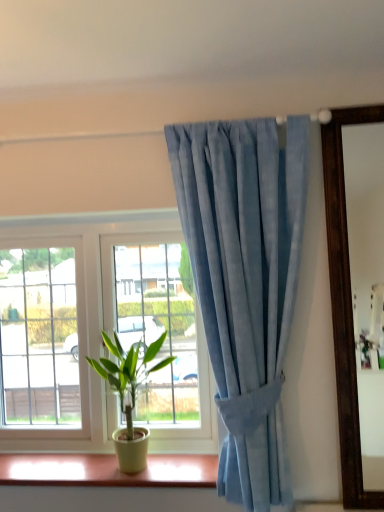
Image resolution: width=384 pixels, height=512 pixels. What do you see at coordinates (129, 395) in the screenshot? I see `green matte plant at lower left` at bounding box center [129, 395].

Find the location of a particular element. light blue fabric curtain at upper center is located at coordinates (245, 282).

Find the location of a particular element. green matte plant at lower left is located at coordinates (129, 395).

Is matte yellow plastic at lower center spatially inside green matte plant at lower left, or outside of it?

matte yellow plastic at lower center is located beyond the bounds of green matte plant at lower left.

Is matte yellow plastic at lower center aimed at green matte plant at lower left?

No, matte yellow plastic at lower center is not aimed at green matte plant at lower left.

Considering the positions of point (92, 466) and point (138, 450), is point (92, 466) closer or farther from the camera than point (138, 450)?

Clearly, point (92, 466) is more distant from the camera than point (138, 450).

Which is more to the right, matte yellow plastic at lower center or green matte plant at lower left?

green matte plant at lower left.

Is matte yellow plastic at lower center not within light blue fabric curtain at upper center?

Yes, matte yellow plastic at lower center is located beyond the bounds of light blue fabric curtain at upper center.

Identify the location of curtain lying in front of the matte yellow plastic at lower center. The image size is (384, 512). (245, 282).

Considering the positions of points (36, 465) and (178, 178), is point (36, 465) closer to camera compared to point (178, 178)?

No, (36, 465) is further to viewer.

Considering the sizes of objects matte yellow plastic at lower center and light blue fabric curtain at upper center in the image provided, who is thinner, matte yellow plastic at lower center or light blue fabric curtain at upper center?

light blue fabric curtain at upper center.

Does light blue fabric curtain at upper center have a greater width compared to matte yellow plastic at lower center?

In fact, light blue fabric curtain at upper center might be narrower than matte yellow plastic at lower center.

Is light blue fabric curtain at upper center far away from matte yellow plastic at lower center?

That's not correct — light blue fabric curtain at upper center is a little close to matte yellow plastic at lower center.

Is the depth of light blue fabric curtain at upper center less than that of matte yellow plastic at lower center?

Yes, light blue fabric curtain at upper center is in front of matte yellow plastic at lower center.

Where is `curtain above the green matte plant at lower left (from a real-world perspective)`? curtain above the green matte plant at lower left (from a real-world perspective) is located at coordinates [x=245, y=282].

Is light blue fabric curtain at upper center thinner than green matte plant at lower left?

Yes.

Looking at this image, considering the positions of objects light blue fabric curtain at upper center and green matte plant at lower left in the image provided, who is more to the left, light blue fabric curtain at upper center or green matte plant at lower left?

green matte plant at lower left is more to the left.

Which object is closer to the camera, light blue fabric curtain at upper center or green matte plant at lower left?

Positioned in front is light blue fabric curtain at upper center.

Choose the correct answer: Is green matte plant at lower left inside matte yellow plastic at lower center or outside it?

green matte plant at lower left is outside matte yellow plastic at lower center.

Consider the image. How different are the orientations of green matte plant at lower left and matte yellow plastic at lower center in degrees?

They differ by 0.533 degrees in their facing directions.

Considering the positions of points (120, 390) and (121, 480), is point (120, 390) farther from camera compared to point (121, 480)?

Yes, it is.

Is green matte plant at lower left inside or outside of light blue fabric curtain at upper center?

green matte plant at lower left is spatially situated outside light blue fabric curtain at upper center.

From a real-world perspective, does green matte plant at lower left sit lower than light blue fabric curtain at upper center?

Yes.

Based on their sizes in the image, would you say green matte plant at lower left is bigger or smaller than light blue fabric curtain at upper center?

Clearly, green matte plant at lower left is smaller in size than light blue fabric curtain at upper center.

From the image's perspective, between green matte plant at lower left and light blue fabric curtain at upper center, which one is located above?

From the image's view, light blue fabric curtain at upper center is above.

This screenshot has width=384, height=512. Find the location of `window sill beneath the green matte plant at lower left (from a real-world perspective)`. window sill beneath the green matte plant at lower left (from a real-world perspective) is located at coordinates (107, 470).

Find the location of a particular element. This screenshot has width=384, height=512. curtain located in front of the matte yellow plastic at lower center is located at coordinates (245, 282).

Estimate the real-world distances between objects in this image. Which object is further from matte yellow plastic at lower center, green matte plant at lower left or light blue fabric curtain at upper center?

Among the two, light blue fabric curtain at upper center is located further to matte yellow plastic at lower center.

Considering their positions, is green matte plant at lower left positioned further to light blue fabric curtain at upper center than matte yellow plastic at lower center?

matte yellow plastic at lower center.

Considering their positions, is light blue fabric curtain at upper center positioned closer to green matte plant at lower left than matte yellow plastic at lower center?

Among the two, matte yellow plastic at lower center is located nearer to green matte plant at lower left.

Based on their spatial positions, is matte yellow plastic at lower center or green matte plant at lower left further from light blue fabric curtain at upper center?

matte yellow plastic at lower center is positioned further to the anchor light blue fabric curtain at upper center.

From the picture: When comparing their distances from matte yellow plastic at lower center, does light blue fabric curtain at upper center or green matte plant at lower left seem further?

Among the two, light blue fabric curtain at upper center is located further to matte yellow plastic at lower center.

Based on their spatial positions, is matte yellow plastic at lower center or light blue fabric curtain at upper center closer to green matte plant at lower left?

Based on the image, matte yellow plastic at lower center appears to be nearer to green matte plant at lower left.

The height and width of the screenshot is (512, 384). I want to click on houseplant between light blue fabric curtain at upper center and matte yellow plastic at lower center from top to bottom, so click(129, 395).